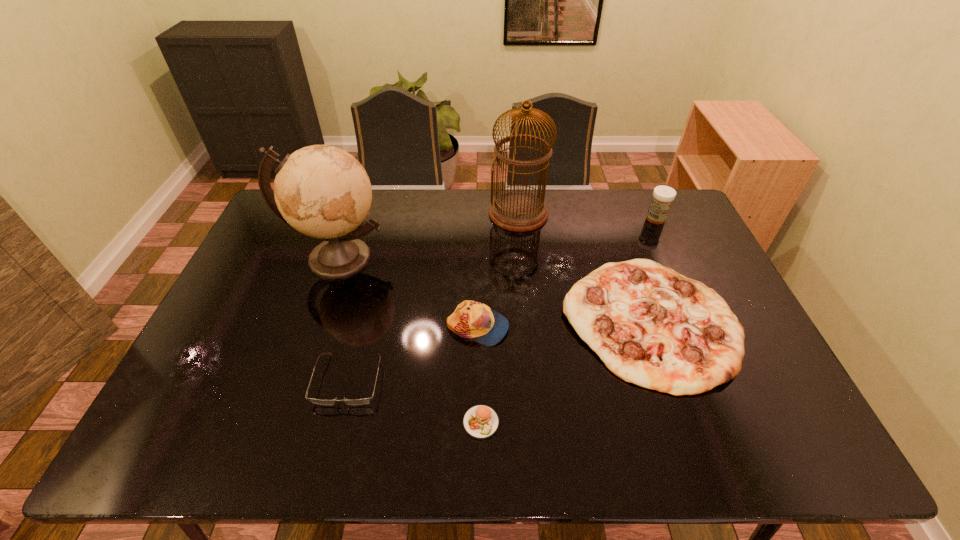
The image size is (960, 540). What are the coordinates of `vacant space that satisfies the following two spatial constraints: 1. on the front side of the pizza; 2. on the bill of the fourth shortest object` in the screenshot? It's located at pyautogui.click(x=651, y=327).

The image size is (960, 540). What are the coordinates of `vacant space that satisfies the following two spatial constraints: 1. on the front-facing side of the birdcage; 2. on the bill of the fourth shortest object` in the screenshot? It's located at (530, 327).

Where is `vacant point that satisfies the following two spatial constraints: 1. on the front-facing side of the globe; 2. on the left side of the third shortest object`? This screenshot has width=960, height=540. vacant point that satisfies the following two spatial constraints: 1. on the front-facing side of the globe; 2. on the left side of the third shortest object is located at coordinates (317, 320).

The height and width of the screenshot is (540, 960). What are the coordinates of `vacant region that satisfies the following two spatial constraints: 1. on the back side of the patty; 2. on the bill of the cap` in the screenshot? It's located at (481, 327).

Locate an element on the screen. The height and width of the screenshot is (540, 960). vacant space that satisfies the following two spatial constraints: 1. on the front-facing side of the birdcage; 2. on the right side of the pizza is located at coordinates (529, 320).